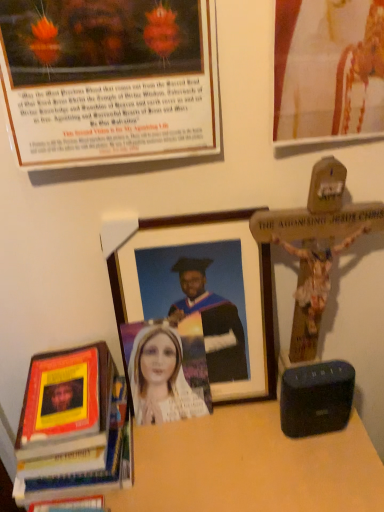
Where is `vacant space that is in between hardcover book at lower left and wooden picture frame at center, acting as the 1th picture frame starting from the bottom`? Image resolution: width=384 pixels, height=512 pixels. vacant space that is in between hardcover book at lower left and wooden picture frame at center, acting as the 1th picture frame starting from the bottom is located at coordinates (187, 443).